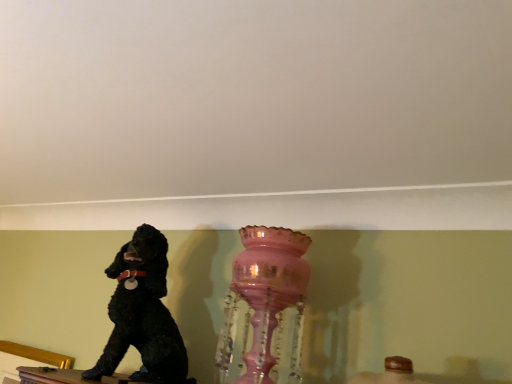
Question: Is black matte dog at left thinner than pink glass vase at center?

Choices:
 (A) yes
 (B) no

Answer: (B)

Question: Is black matte dog at left smaller than pink glass vase at center?

Choices:
 (A) no
 (B) yes

Answer: (A)

Question: From a real-world perspective, is black matte dog at left on pink glass vase at center?

Choices:
 (A) no
 (B) yes

Answer: (A)

Question: From the image's perspective, does black matte dog at left appear lower than pink glass vase at center?

Choices:
 (A) no
 (B) yes

Answer: (B)

Question: From a real-world perspective, does black matte dog at left sit lower than pink glass vase at center?

Choices:
 (A) yes
 (B) no

Answer: (A)

Question: Is black matte dog at left beside pink glass vase at center?

Choices:
 (A) no
 (B) yes

Answer: (A)

Question: Does pink glass vase at center have a lesser width compared to black matte dog at left?

Choices:
 (A) yes
 (B) no

Answer: (A)

Question: From a real-world perspective, is pink glass vase at center below black matte dog at left?

Choices:
 (A) yes
 (B) no

Answer: (B)

Question: Can you confirm if pink glass vase at center is bigger than black matte dog at left?

Choices:
 (A) yes
 (B) no

Answer: (B)

Question: Does pink glass vase at center lie in front of black matte dog at left?

Choices:
 (A) yes
 (B) no

Answer: (A)

Question: Can you confirm if pink glass vase at center is smaller than black matte dog at left?

Choices:
 (A) no
 (B) yes

Answer: (B)

Question: Does pink glass vase at center lie behind black matte dog at left?

Choices:
 (A) no
 (B) yes

Answer: (A)

Question: Is pink glass vase at center inside or outside of black matte dog at left?

Choices:
 (A) inside
 (B) outside

Answer: (B)